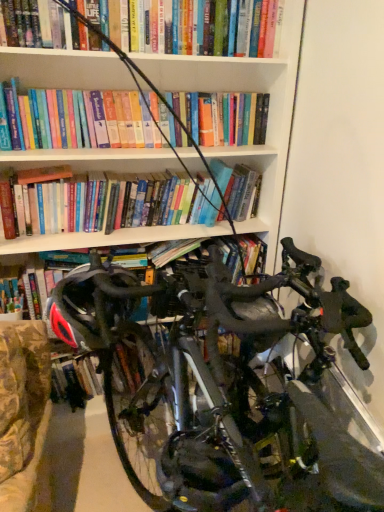
Question: From a real-world perspective, relative to black matte helmet at center, is shiny black bicycle at center vertically above or below?

Choices:
 (A) below
 (B) above

Answer: (A)

Question: Is shiny black bicycle at center taller or shorter than black matte helmet at center?

Choices:
 (A) short
 (B) tall

Answer: (B)

Question: Is shiny black bicycle at center wider or thinner than black matte helmet at center?

Choices:
 (A) thin
 (B) wide

Answer: (B)

Question: Does point (61, 324) appear closer or farther from the camera than point (281, 394)?

Choices:
 (A) farther
 (B) closer

Answer: (B)

Question: Is black matte helmet at center in front of or behind shiny black bicycle at center in the image?

Choices:
 (A) front
 (B) behind

Answer: (B)

Question: Would you say black matte helmet at center is inside or outside shiny black bicycle at center?

Choices:
 (A) inside
 (B) outside

Answer: (A)

Question: From the image's perspective, is black matte helmet at center above or below shiny black bicycle at center?

Choices:
 (A) below
 (B) above

Answer: (B)